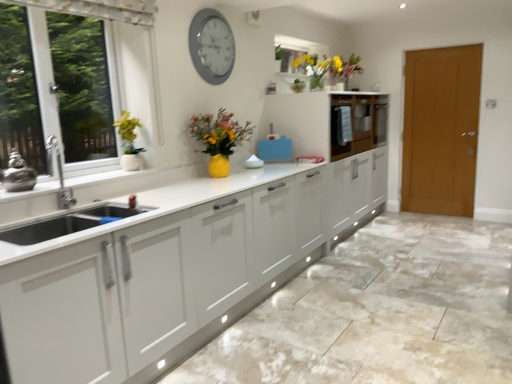
The image size is (512, 384). In order to click on blank space situated above silver metallic clock at upper center (from a real-world perspective) in this screenshot , I will do `click(208, 8)`.